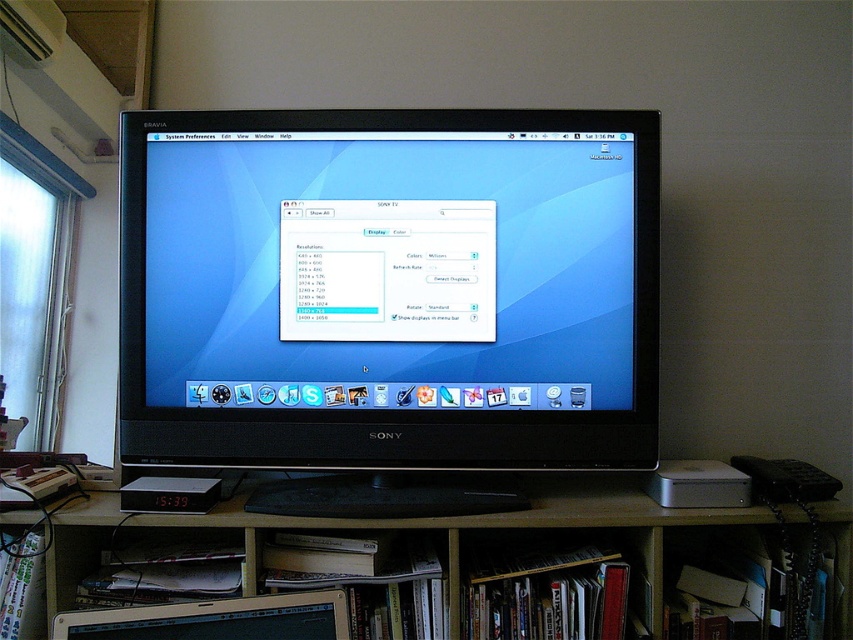
Question: Does wooden at lower center have a larger size compared to dark wood bookshelf at lower center?

Choices:
 (A) yes
 (B) no

Answer: (A)

Question: Among these objects, which one is farthest from the camera?

Choices:
 (A) metallic silver laptop at lower center
 (B) black glossy monitor at center

Answer: (B)

Question: Which point is closer to the camera?

Choices:
 (A) (602, 609)
 (B) (138, 620)

Answer: (B)

Question: Which of the following is the farthest from the observer?

Choices:
 (A) (212, 609)
 (B) (553, 547)
 (C) (567, 604)

Answer: (B)

Question: Is dark wood bookshelf at lower center closer to camera compared to metallic silver laptop at lower center?

Choices:
 (A) yes
 (B) no

Answer: (B)

Question: Can you confirm if black glossy monitor at center is thinner than wooden at lower center?

Choices:
 (A) yes
 (B) no

Answer: (A)